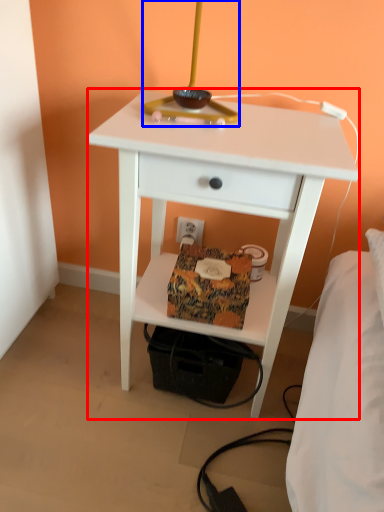
Question: Which object is further to the camera taking this photo, nightstand (highlighted by a red box) or table lamp (highlighted by a blue box)?

Choices:
 (A) nightstand
 (B) table lamp

Answer: (A)